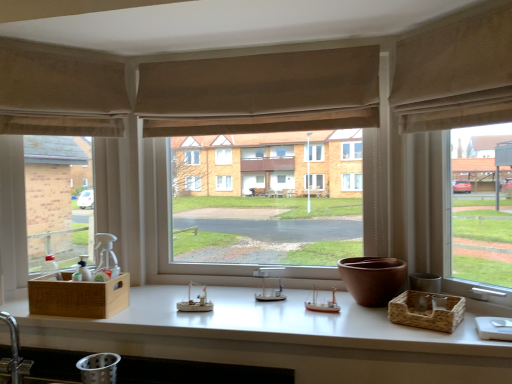
Locate an element on the screen. The image size is (512, 384). vacant space underneath beige textured curtain at center, the second curtain positioned from the front (from a real-world perspective) is located at coordinates (228, 291).